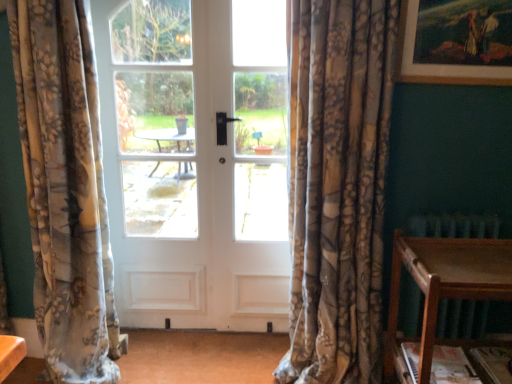
Question: Is white matte door at center in front of or behind wooden table at lower right in the image?

Choices:
 (A) front
 (B) behind

Answer: (B)

Question: In terms of height, does white matte door at center look taller or shorter compared to wooden table at lower right?

Choices:
 (A) tall
 (B) short

Answer: (A)

Question: Which object is the closest to the wooden table at lower right?

Choices:
 (A) white matte door at center
 (B) floral fabric curtain at left, the second curtain from the right
 (C) wooden picture frame at upper right
 (D) floral fabric curtain at center, the second curtain from the left

Answer: (D)

Question: Considering the real-world distances, which object is farthest from the floral fabric curtain at center, arranged as the 1th curtain when viewed from the right?

Choices:
 (A) white matte door at center
 (B) wooden picture frame at upper right
 (C) wooden table at lower right
 (D) floral fabric curtain at left, the 1th curtain viewed from the left

Answer: (D)